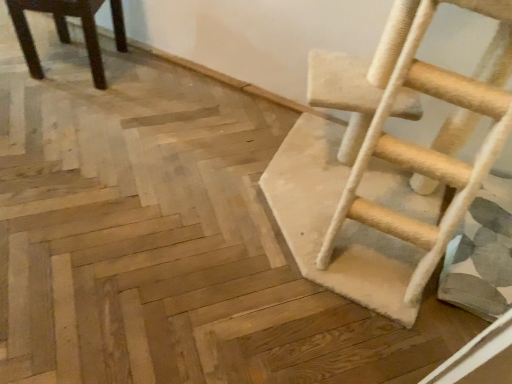
Question: Which is correct: beige carpeted ladder at right is inside dark brown wood chair at upper left, or outside of it?

Choices:
 (A) inside
 (B) outside

Answer: (B)

Question: Considering the positions of beige carpeted ladder at right and dark brown wood chair at upper left in the image, is beige carpeted ladder at right wider or thinner than dark brown wood chair at upper left?

Choices:
 (A) thin
 (B) wide

Answer: (B)

Question: Based on their sizes in the image, would you say beige carpeted ladder at right is bigger or smaller than dark brown wood chair at upper left?

Choices:
 (A) small
 (B) big

Answer: (B)

Question: Considering their positions, is dark brown wood chair at upper left located in front of or behind beige carpeted ladder at right?

Choices:
 (A) front
 (B) behind

Answer: (B)

Question: Does point (32, 41) appear closer or farther from the camera than point (458, 178)?

Choices:
 (A) closer
 (B) farther

Answer: (B)

Question: In terms of height, does dark brown wood chair at upper left look taller or shorter compared to beige carpeted ladder at right?

Choices:
 (A) short
 (B) tall

Answer: (A)

Question: In terms of size, does dark brown wood chair at upper left appear bigger or smaller than beige carpeted ladder at right?

Choices:
 (A) big
 (B) small

Answer: (B)